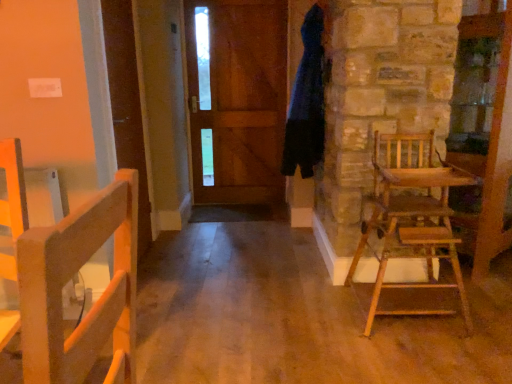
Question: Is wooden door at center bigger than wooden high chair at right?

Choices:
 (A) no
 (B) yes

Answer: (A)

Question: Is wooden door at center facing towards wooden high chair at right?

Choices:
 (A) yes
 (B) no

Answer: (B)

Question: Can you confirm if wooden door at center is taller than wooden high chair at right?

Choices:
 (A) no
 (B) yes

Answer: (B)

Question: From the image's perspective, is wooden door at center located beneath wooden high chair at right?

Choices:
 (A) no
 (B) yes

Answer: (A)

Question: From a real-world perspective, does wooden door at center stand above wooden high chair at right?

Choices:
 (A) no
 (B) yes

Answer: (B)

Question: Is wooden door at center located outside wooden high chair at right?

Choices:
 (A) no
 (B) yes

Answer: (B)

Question: Considering the relative sizes of dark blue fabric bathrobe at upper right and wooden door at center in the image provided, is dark blue fabric bathrobe at upper right wider than wooden door at center?

Choices:
 (A) yes
 (B) no

Answer: (A)

Question: Does dark blue fabric bathrobe at upper right come behind wooden door at center?

Choices:
 (A) yes
 (B) no

Answer: (B)

Question: Considering the relative positions of dark blue fabric bathrobe at upper right and wooden door at center in the image provided, is dark blue fabric bathrobe at upper right to the left of wooden door at center from the viewer's perspective?

Choices:
 (A) yes
 (B) no

Answer: (B)

Question: Does dark blue fabric bathrobe at upper right have a lesser width compared to wooden door at center?

Choices:
 (A) yes
 (B) no

Answer: (B)

Question: Is dark blue fabric bathrobe at upper right far away from wooden door at center?

Choices:
 (A) no
 (B) yes

Answer: (B)

Question: Can you confirm if dark blue fabric bathrobe at upper right is bigger than wooden door at center?

Choices:
 (A) no
 (B) yes

Answer: (B)

Question: From the image's perspective, is wooden high chair at right beneath wooden door at center?

Choices:
 (A) yes
 (B) no

Answer: (A)